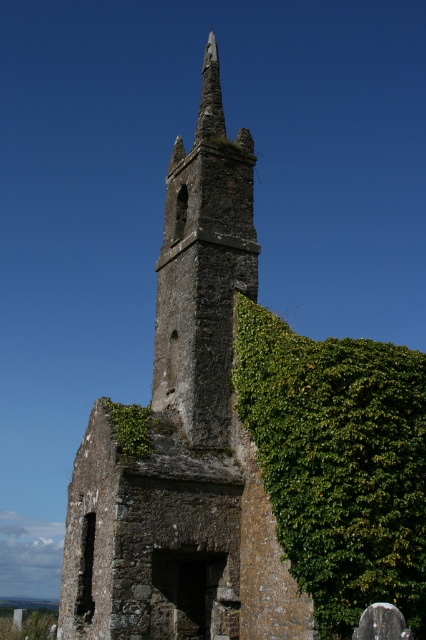
Question: Which point is farther from the camera taking this photo?

Choices:
 (A) (236, 164)
 (B) (175, 340)

Answer: (A)

Question: Does rusty stone church steeple at center appear over rusty stone tower at center?

Choices:
 (A) no
 (B) yes

Answer: (B)

Question: Is the position of rusty stone church steeple at center less distant than that of rusty stone tower at center?

Choices:
 (A) yes
 (B) no

Answer: (A)

Question: Which object appears closest to the camera in this image?

Choices:
 (A) rusty stone church steeple at center
 (B) rusty stone tower at center

Answer: (A)

Question: Which point is closer to the camera taking this photo?

Choices:
 (A) (149, 544)
 (B) (198, 330)

Answer: (A)

Question: Does rusty stone church steeple at center lie behind rusty stone tower at center?

Choices:
 (A) no
 (B) yes

Answer: (A)